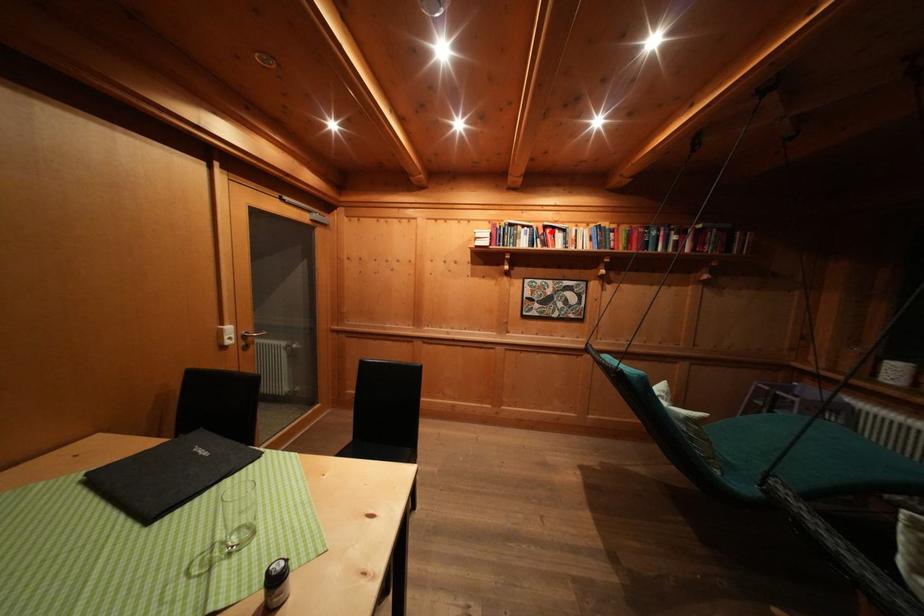
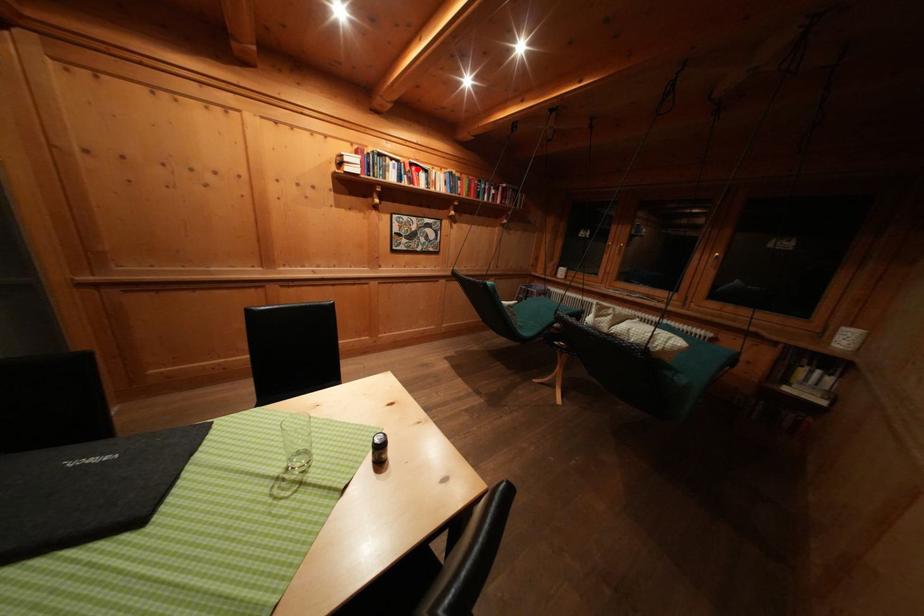
I am providing you with two images of the same scene from different viewpoints. A red point is marked on the first image and another point is marked on the second image. Is the marked point in image1 the same physical position as the marked point in image2?

Yes